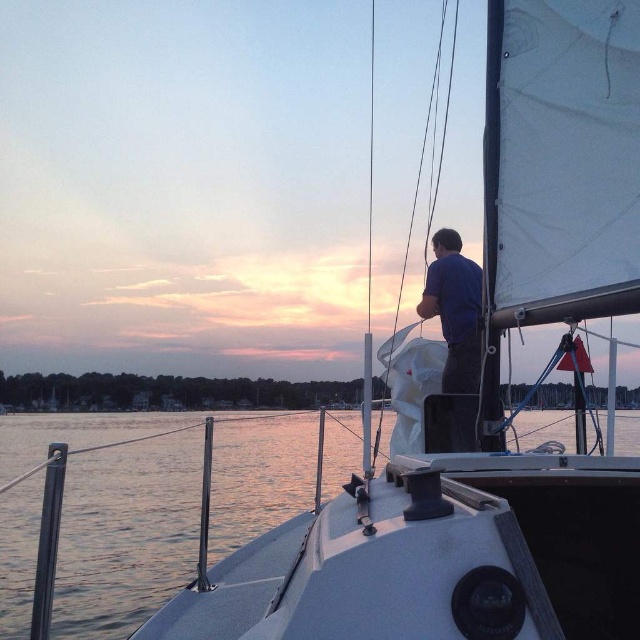
Is clear water at lower left above dark blue shirt at upper center?

Incorrect, clear water at lower left is not positioned above dark blue shirt at upper center.

Is point (227, 518) farther from camera compared to point (470, 371)?

Yes.

Which is behind, point (177, 508) or point (476, 352)?

Point (177, 508)

Find the location of a particular element. Image resolution: width=640 pixels, height=640 pixels. clear water at lower left is located at coordinates (125, 531).